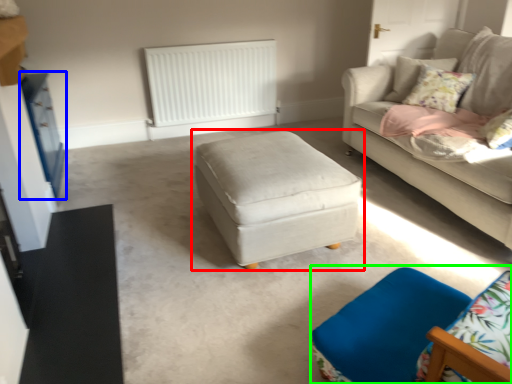
Question: Estimate the real-world distances between objects in this image. Which object is farther from table (highlighted by a red box), dresser (highlighted by a blue box) or swivel chair (highlighted by a green box)?

Choices:
 (A) dresser
 (B) swivel chair

Answer: (A)